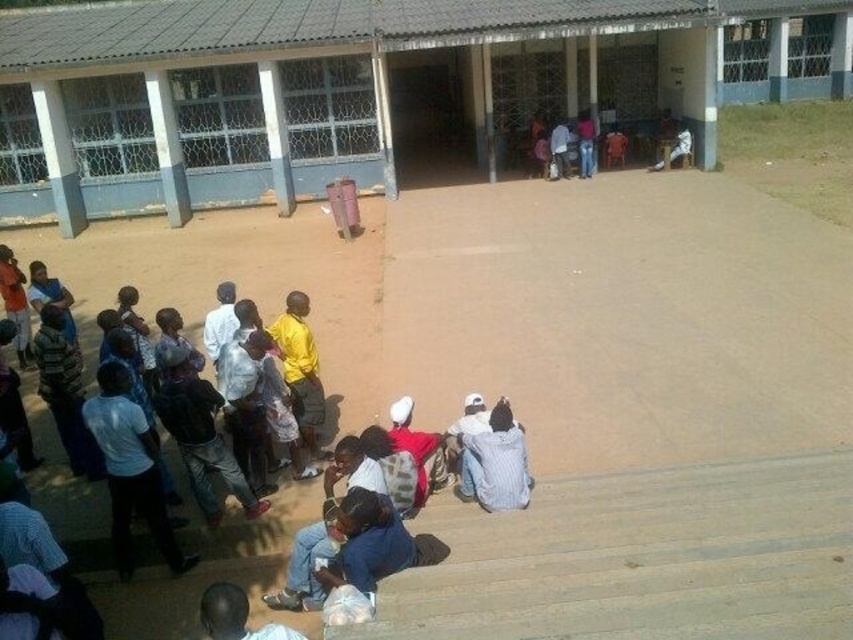
From the picture: You are a photographer standing in front of the gray concrete building at center and the dark blue shirt at lower left. You want to take a photo that includes both objects in the frame. Which object should you position closer to the bottom of the image to ensure both are visible?

The dark blue shirt at lower left should be positioned closer to the bottom of the image because the gray concrete building at center is located above it, so placing the shirt lower will allow both to fit within the frame.

You are a photographer trying to capture a wide shot of the gray concrete building at center and the dark blue shirt at lower left. Since you want both subjects to be clearly visible in the frame, which one should you focus on first to ensure sharpness?

The gray concrete building at center is larger in size than the dark blue shirt at lower left, so you should focus on the gray concrete building at center first to ensure it is sharp, as larger objects generally require more precise focus to maintain clarity throughout the entire subject.